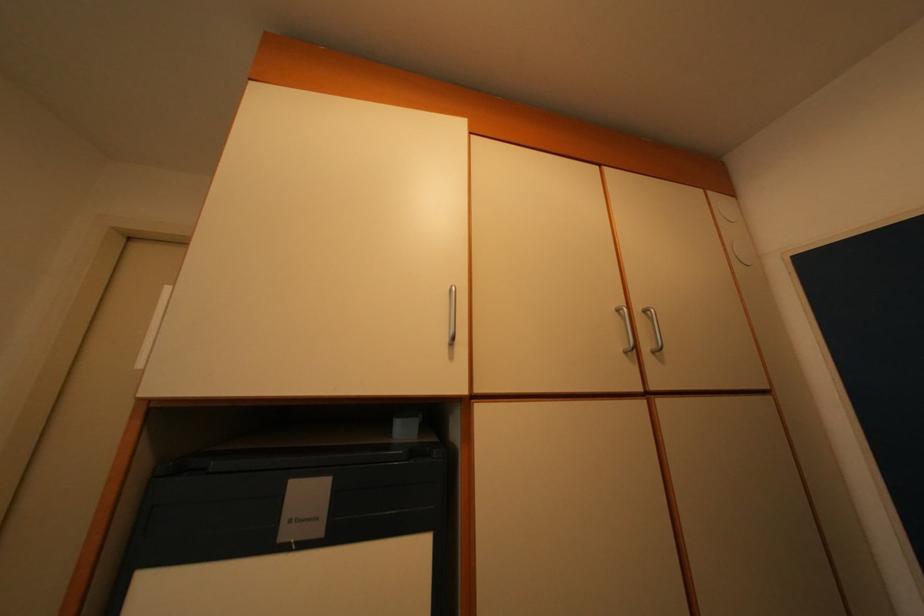
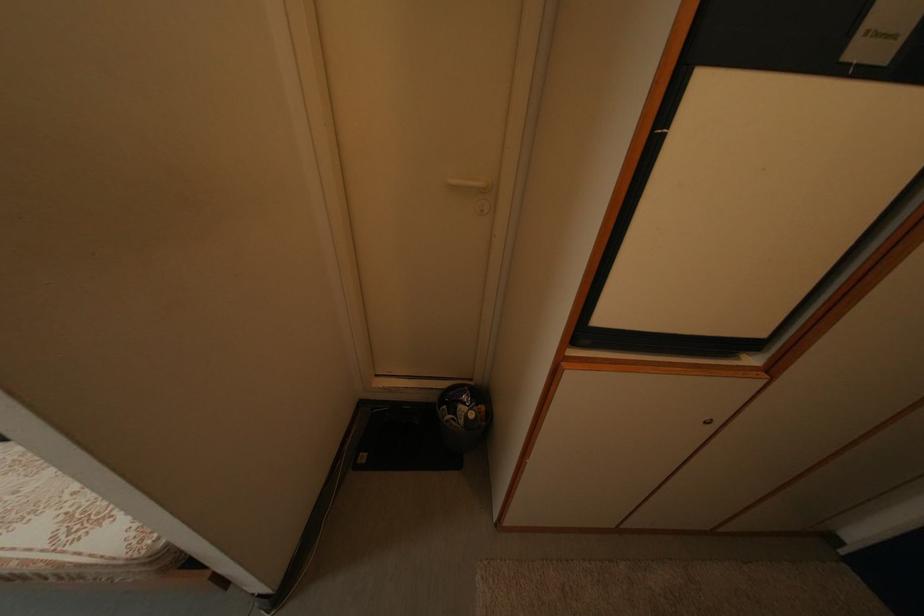
Question: How did the camera likely rotate?

Choices:
 (A) Left
 (B) Right
 (C) Up
 (D) Down

Answer: (D)